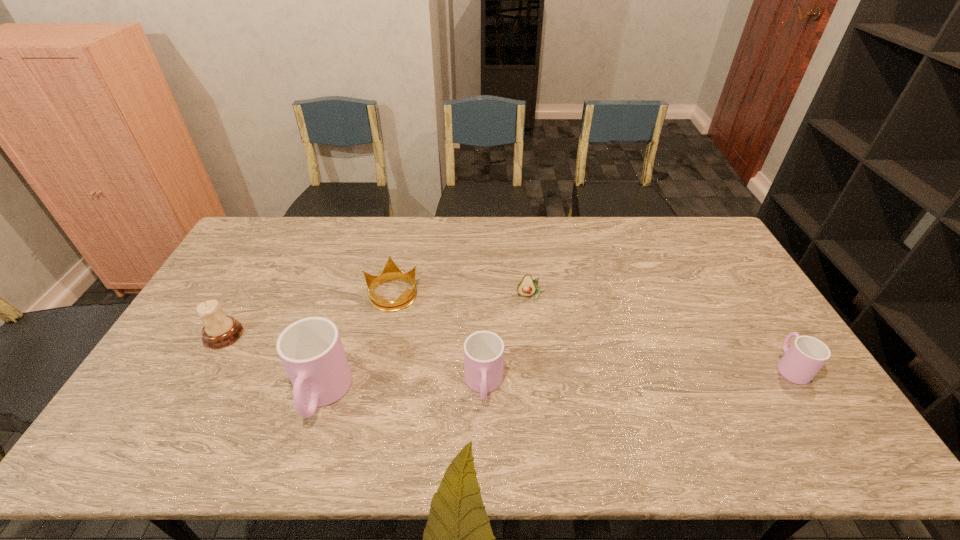
Where is `vacant space located with the handle on the side of the shortest cup`? This screenshot has height=540, width=960. vacant space located with the handle on the side of the shortest cup is located at coordinates (757, 315).

At what (x,y) coordinates should I click in order to perform the action: click on free space located with the handle on the side of the shortest cup. Please return your answer as a coordinate pair (x, y). The width and height of the screenshot is (960, 540). Looking at the image, I should click on (761, 320).

At what (x,y) coordinates should I click in order to perform the action: click on vacant region located 0.090m on the right of the candle holder. Please return your answer as a coordinate pair (x, y). This screenshot has height=540, width=960. Looking at the image, I should click on (273, 335).

Find the location of a particular element. This screenshot has width=960, height=540. vacant space situated on the seed side of the avocado is located at coordinates (537, 343).

Where is `vacant space located 0.270m on the back of the crown`? vacant space located 0.270m on the back of the crown is located at coordinates (406, 230).

This screenshot has height=540, width=960. Find the location of `object that is at the left edge`. object that is at the left edge is located at coordinates (219, 331).

You are a GUI agent. You are given a task and a screenshot of the screen. Output one action in this format:
    pyautogui.click(x=<x>, y=<y>)
    Task: Click on the object that is at the right edge
    The image size is (960, 540).
    Given the screenshot: What is the action you would take?
    pyautogui.click(x=805, y=357)

At what (x,y) coordinates should I click in order to perform the action: click on free point at the far edge. Please return your answer as a coordinate pair (x, y). Looking at the image, I should click on (302, 247).

In the image, there is a desktop. What are the coordinates of `free space at the near edge` in the screenshot? It's located at click(x=462, y=389).

In the image, there is a desktop. Identify the location of blank space at the left edge. (238, 276).